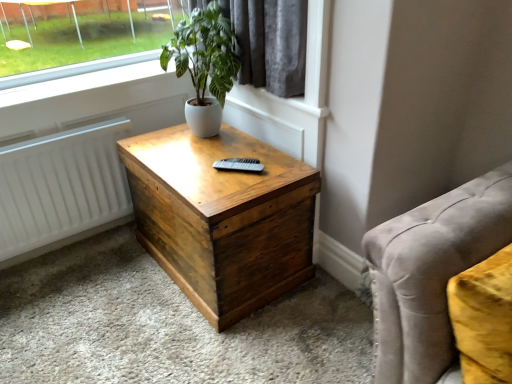
Where is `free space above wooden nightstand at center (from a real-world perspective)`? The image size is (512, 384). free space above wooden nightstand at center (from a real-world perspective) is located at coordinates (229, 153).